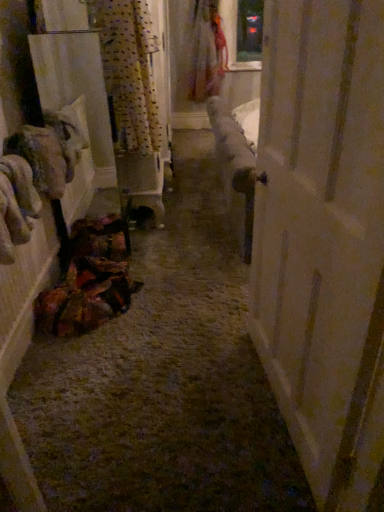
Where is `patterned fabric curtain at upper left`? Image resolution: width=384 pixels, height=512 pixels. patterned fabric curtain at upper left is located at coordinates (129, 70).

This screenshot has height=512, width=384. Describe the element at coordinates (129, 70) in the screenshot. I see `patterned fabric curtain at upper left` at that location.

You are a GUI agent. You are given a task and a screenshot of the screen. Output one action in this format:
    pyautogui.click(x=<x>, y=<y>)
    Task: Click on the white wood door at right
    
    Given the screenshot: What is the action you would take?
    pyautogui.click(x=323, y=239)

Identify the location of patterned fabric curtain at upper left. The height and width of the screenshot is (512, 384). (129, 70).

In the scene shown: Is there a large distance between white wood door at right and patterned fabric curtain at upper left?

That's right, there is a large distance between white wood door at right and patterned fabric curtain at upper left.

In terms of width, does white wood door at right look wider or thinner when compared to patterned fabric curtain at upper left?

In the image, white wood door at right appears to be more narrow than patterned fabric curtain at upper left.

Do you think white wood door at right is within patterned fabric curtain at upper left, or outside of it?

white wood door at right lies outside patterned fabric curtain at upper left.

Is point (151, 35) closer to camera compared to point (220, 24)?

Yes, point (151, 35) is closer to viewer.

From the picture: From a real-world perspective, does patterned fabric curtain at upper left stand above floral fabric dress at upper center?

Indeed, from a real-world perspective, patterned fabric curtain at upper left stands above floral fabric dress at upper center.

Is patterned fabric curtain at upper left facing towards floral fabric dress at upper center?

No, patterned fabric curtain at upper left is not oriented towards floral fabric dress at upper center.

Is floral fabric dress at upper center bigger than patterned fabric curtain at upper left?

Correct, floral fabric dress at upper center is larger in size than patterned fabric curtain at upper left.

In the image, is floral fabric dress at upper center on the left side or the right side of patterned fabric curtain at upper left?

In the image, floral fabric dress at upper center appears on the right side of patterned fabric curtain at upper left.

Can you tell me how much floral fabric dress at upper center and patterned fabric curtain at upper left differ in facing direction?

0.0157 degrees separate the facing orientations of floral fabric dress at upper center and patterned fabric curtain at upper left.

Which is behind, patterned fabric curtain at upper left or white wood door at right?

patterned fabric curtain at upper left is more distant.

From their relative heights in the image, would you say patterned fabric curtain at upper left is taller or shorter than white wood door at right?

In the image, patterned fabric curtain at upper left appears to be shorter than white wood door at right.

From the image's perspective, is patterned fabric curtain at upper left on top of white wood door at right?

Yes, from the image's perspective, patterned fabric curtain at upper left is on top of white wood door at right.

Is patterned fabric curtain at upper left not close to white wood door at right?

patterned fabric curtain at upper left is far away from white wood door at right.

Image resolution: width=384 pixels, height=512 pixels. I want to click on door below the floral fabric dress at upper center (from the image's perspective), so click(323, 239).

From a real-world perspective, does floral fabric dress at upper center stand above white wood door at right?

Yes, from a real-world perspective, floral fabric dress at upper center is above white wood door at right.

Measure the distance from floral fabric dress at upper center to white wood door at right.

floral fabric dress at upper center and white wood door at right are 3.71 meters apart from each other.

From a real-world perspective, who is located higher, white wood door at right or floral fabric dress at upper center?

floral fabric dress at upper center, from a real-world perspective.

Is white wood door at right inside the boundaries of floral fabric dress at upper center, or outside?

white wood door at right is spatially situated outside floral fabric dress at upper center.

Is white wood door at right aimed at floral fabric dress at upper center?

No.

Between white wood door at right and floral fabric dress at upper center, which one has more height?

white wood door at right is taller.

Where is `curtain that appears behind the white wood door at right`? The image size is (384, 512). curtain that appears behind the white wood door at right is located at coordinates (129, 70).

You are a GUI agent. You are given a task and a screenshot of the screen. Output one action in this format:
    pyautogui.click(x=<x>, y=<y>)
    Task: Click on the clothing below the patterned fabric curtain at upper left (from a real-world perspective)
    This screenshot has width=384, height=512.
    Given the screenshot: What is the action you would take?
    pos(206,52)

Considering their positions, is patterned fabric curtain at upper left positioned further to white wood door at right than floral fabric dress at upper center?

Based on the image, floral fabric dress at upper center appears to be further to white wood door at right.

Estimate the real-world distances between objects in this image. Which object is further from patterned fabric curtain at upper left, floral fabric dress at upper center or white wood door at right?

floral fabric dress at upper center is positioned further to the anchor patterned fabric curtain at upper left.

Considering their positions, is white wood door at right positioned further to floral fabric dress at upper center than patterned fabric curtain at upper left?

white wood door at right is positioned further to the anchor floral fabric dress at upper center.

When comparing their distances from white wood door at right, does floral fabric dress at upper center or patterned fabric curtain at upper left seem further?

Based on the image, floral fabric dress at upper center appears to be further to white wood door at right.

In the scene shown: From the image, which object appears to be nearer to patterned fabric curtain at upper left, white wood door at right or floral fabric dress at upper center?

Among the two, white wood door at right is located nearer to patterned fabric curtain at upper left.

Estimate the real-world distances between objects in this image. Which object is closer to floral fabric dress at upper center, patterned fabric curtain at upper left or white wood door at right?

Among the two, patterned fabric curtain at upper left is located nearer to floral fabric dress at upper center.

Image resolution: width=384 pixels, height=512 pixels. In order to click on curtain located between white wood door at right and floral fabric dress at upper center in the depth direction in this screenshot , I will do `click(129, 70)`.